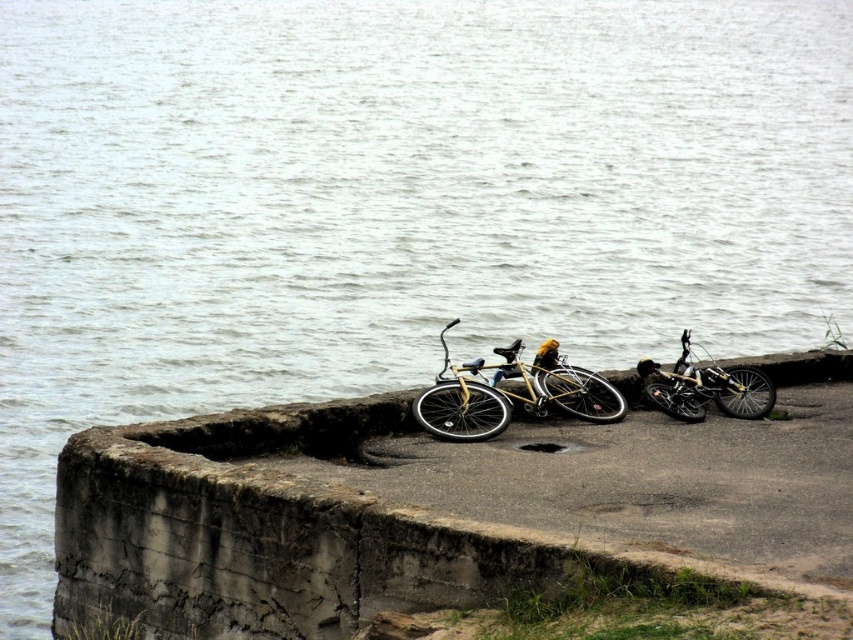
You are a delivery person who needs to load a package onto the yellow matte bicycle at center and the shiny metallic bicycle at right. Which bicycle will require more space for the package?

The shiny metallic bicycle at right requires more space for the package because it occupies more space than the yellow matte bicycle at center according to the description.

You are a delivery person who needs to place a package on the concrete at center. The package requires a flat surface that is at least 8 meters away from the shiny metallic bicycle at right to avoid blocking the path. Based on the scene, can you place the package there?

The concrete at center and shiny metallic bicycle at right are 7.36 meters apart. Since 7.36 meters is less than the required 8 meters, placing the package there would not meet the distance requirement and might block the path.

You are a delivery person who needs to choose between the yellow matte bicycle at center and the shiny metallic bicycle at right to carry a large package. Which bicycle would you choose and why?

You should choose the shiny metallic bicycle at right because it has a greater width than the yellow matte bicycle at center, providing more space to securely attach the large package.